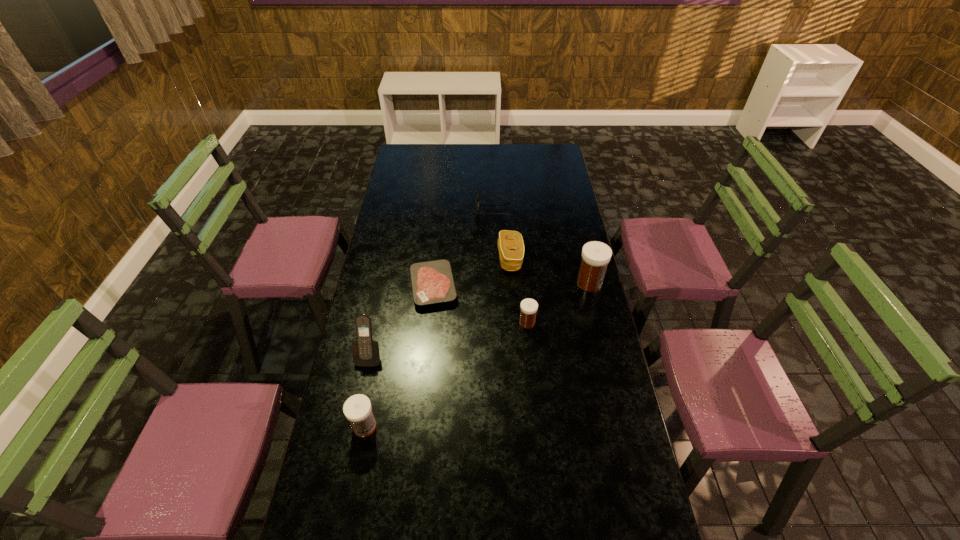
You are a GUI agent. You are given a task and a screenshot of the screen. Output one action in this format:
    pyautogui.click(x=<x>, y=<y>)
    Task: Click on the nearest object
    
    Given the screenshot: What is the action you would take?
    pyautogui.click(x=357, y=409)

The width and height of the screenshot is (960, 540). In order to click on the leftmost medicine in this screenshot , I will do `click(357, 409)`.

The width and height of the screenshot is (960, 540). I want to click on the second nearest medicine, so click(529, 307).

At what (x,y) coordinates should I click in order to perform the action: click on the shortest medicine. Please return your answer as a coordinate pair (x, y). The height and width of the screenshot is (540, 960). Looking at the image, I should click on tap(529, 307).

What are the coordinates of `the rightmost object` in the screenshot? It's located at (596, 255).

At what (x,y) coordinates should I click in order to perform the action: click on the farthest medicine. Please return your answer as a coordinate pair (x, y). This screenshot has height=540, width=960. Looking at the image, I should click on (596, 255).

This screenshot has width=960, height=540. Identify the location of the shortest object. (432, 282).

You are a GUI agent. You are given a task and a screenshot of the screen. Output one action in this format:
    pyautogui.click(x=<x>, y=<y>)
    Task: Click on the steak
    This screenshot has width=960, height=540.
    Given the screenshot: What is the action you would take?
    pyautogui.click(x=432, y=282)

Locate an element on the screen. the farthest object is located at coordinates (477, 213).

At what (x,y) coordinates should I click in order to perform the action: click on sunglasses. Please return your answer as a coordinate pair (x, y). The height and width of the screenshot is (540, 960). Looking at the image, I should click on (477, 213).